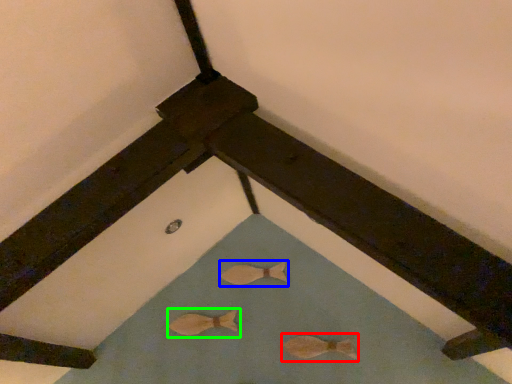
Question: Considering the real-world distances, which object is farthest from animal (highlighted by a red box)? animal (highlighted by a blue box) or animal (highlighted by a green box)?

Choices:
 (A) animal
 (B) animal

Answer: (B)